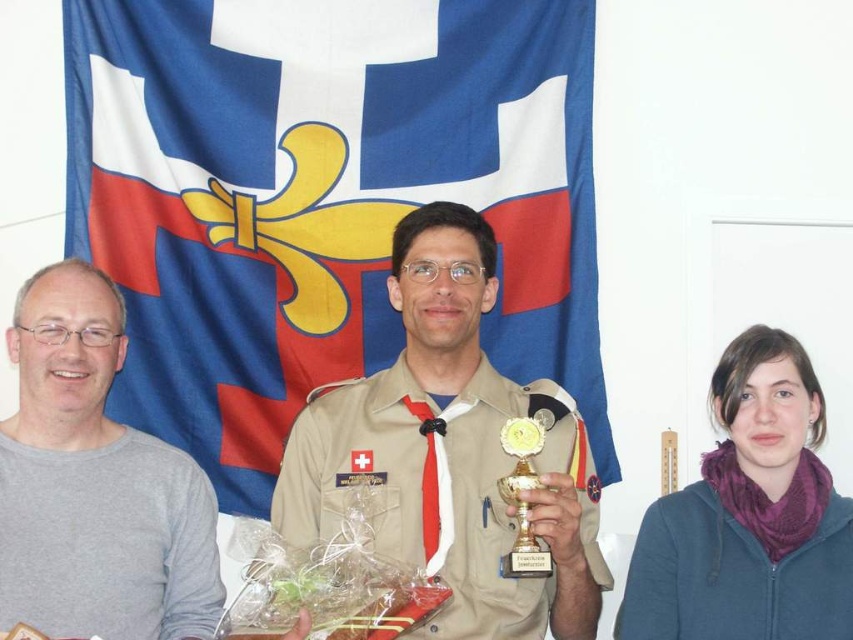
Can you confirm if khaki uniform at center is positioned to the left of gray matte sweater at left?

Incorrect, khaki uniform at center is not on the left side of gray matte sweater at left.

Who is positioned more to the right, khaki uniform at center or gray matte sweater at left?

Positioned to the right is khaki uniform at center.

Who is more forward, (399,376) or (3,529)?

Point (3,529) is more forward.

At what (x,y) coordinates should I click in order to perform the action: click on khaki uniform at center. Please return your answer as a coordinate pair (x, y). The height and width of the screenshot is (640, 853). Looking at the image, I should click on (450, 451).

Is point (158, 147) less distant than point (538, 561)?

No, it is behind (538, 561).

Who is more distant from viewer, (236, 88) or (544, 570)?

Point (236, 88)

Is point (395, 353) positioned in front of point (540, 444)?

No.

You are a GUI agent. You are given a task and a screenshot of the screen. Output one action in this format:
    pyautogui.click(x=<x>, y=<y>)
    Task: Click on the blue fabric flag at upper center
    
    Given the screenshot: What is the action you would take?
    pyautogui.click(x=322, y=198)

Who is higher up, purple fleece scarf at lower right or gold metallic trophy at center?

gold metallic trophy at center

Which is behind, point (657, 541) or point (527, 516)?

Point (657, 541)

What are the coordinates of `purple fleece scarf at lower right` in the screenshot? It's located at (749, 515).